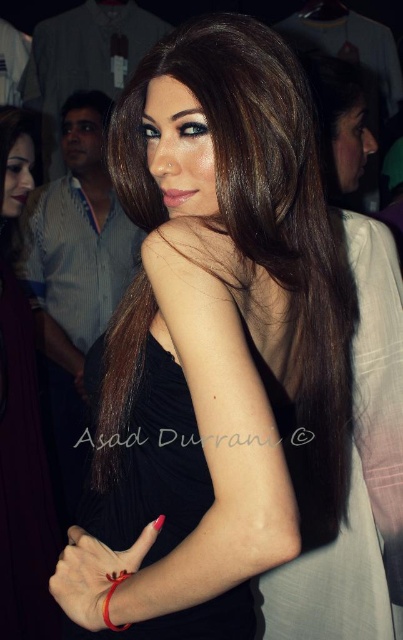
You are at a fashion event and see the black matte dress at center and the red matte bracelet at lower left. Which item is positioned to the left?

The black matte dress at center is to the left of the red matte bracelet at lower left.

You are at a fashion event and want to locate the black matte dress at center. According to the coordinates provided, where should you look?

You should look at point (22,417) to find the black matte dress at center.

You are a fashion designer observing the scene. You need to decide which item to place in a showcase that can only accommodate items larger than a certain size. Based on the image, which item between the black ribbed dress at center and the red matte bracelet at lower left should you choose?

The black ribbed dress at center has a larger size compared to the red matte bracelet at lower left, so you should choose the black ribbed dress at center for the showcase.